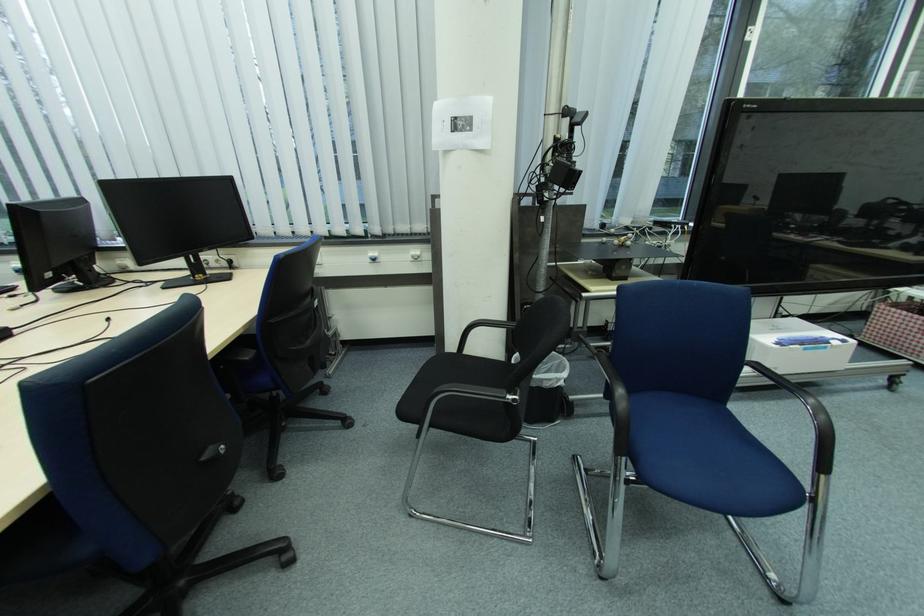
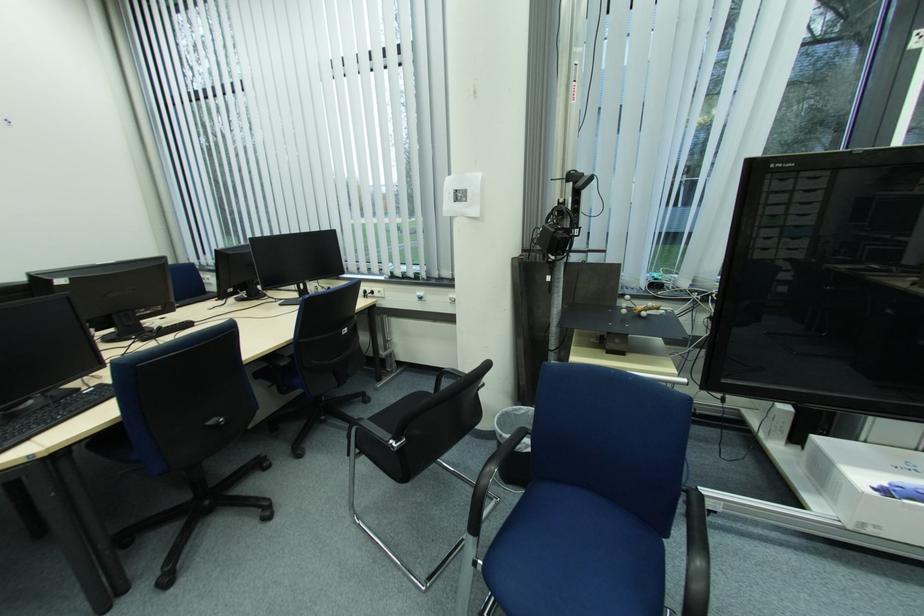
Question: The camera is either moving clockwise (left) or counter-clockwise (right) around the object. The first image is from the beginning of the video and the second image is from the end. Is the camera moving left or right when shooting the video?

Choices:
 (A) Left
 (B) Right

Answer: (B)